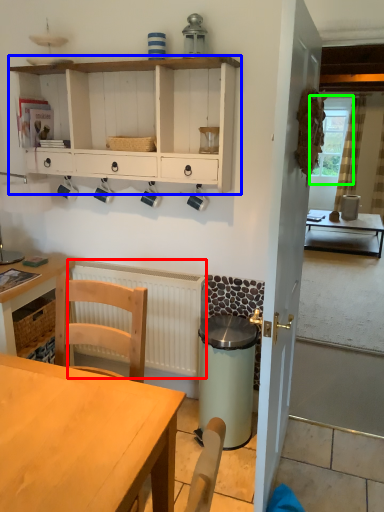
Question: Considering the real-world distances, which object is closest to radiator (highlighted by a red box)? cabinetry (highlighted by a blue box) or window screen (highlighted by a green box).

Choices:
 (A) cabinetry
 (B) window screen

Answer: (A)